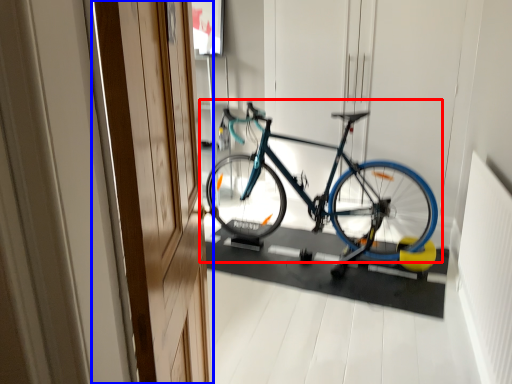
Question: Which of the following is the farthest to the observer, bicycle (highlighted by a red box) or door (highlighted by a blue box)?

Choices:
 (A) bicycle
 (B) door

Answer: (A)